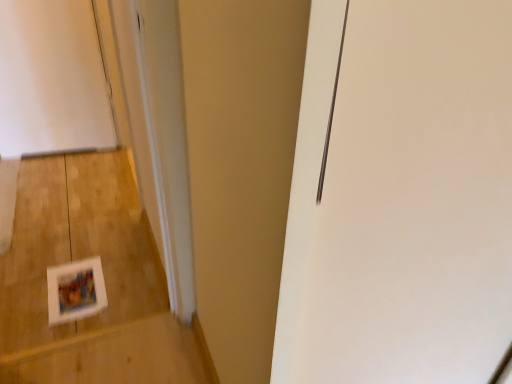
This screenshot has width=512, height=384. I want to click on free space to the left of matte white postcard at lower left, so click(27, 278).